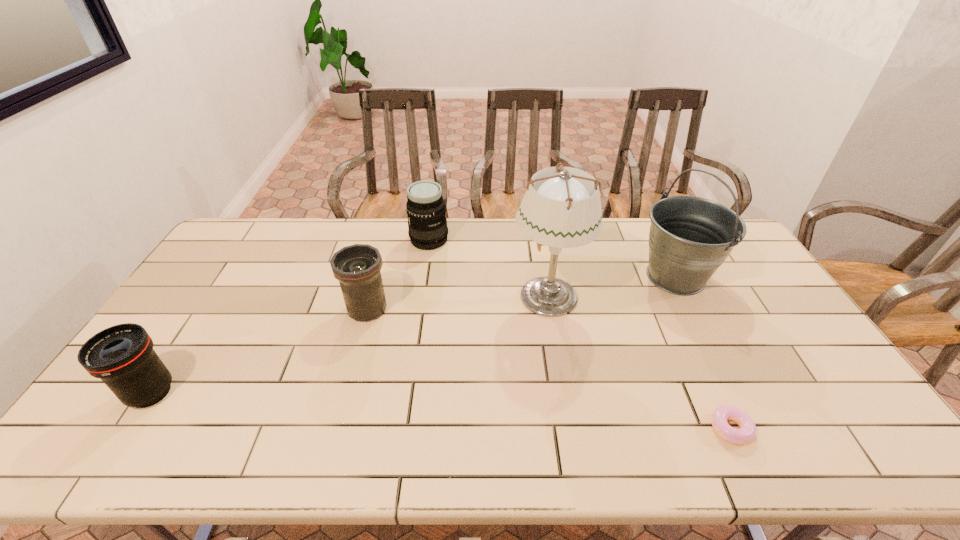
Identify the location of object positioned at the left edge. (122, 356).

Where is `object that is at the right edge`? object that is at the right edge is located at coordinates (690, 237).

I want to click on object that is at the far right corner, so click(x=690, y=237).

This screenshot has height=540, width=960. In the image, there is a desktop. What are the coordinates of `blank space at the far edge` in the screenshot? It's located at (274, 246).

At what (x,y) coordinates should I click in order to perform the action: click on free region at the near edge of the desktop. Please return your answer as a coordinate pair (x, y). The image size is (960, 540). Looking at the image, I should click on (585, 427).

At what (x,y) coordinates should I click in order to perform the action: click on free space at the left edge of the desktop. Please return your answer as a coordinate pair (x, y). This screenshot has width=960, height=540. Looking at the image, I should click on (217, 303).

In the image, there is a desktop. At what (x,y) coordinates should I click in order to perform the action: click on free space at the right edge. Please return your answer as a coordinate pair (x, y). Looking at the image, I should click on (767, 346).

Locate an element on the screen. The width and height of the screenshot is (960, 540). free space between the shortest object and the second nearest telephoto lens is located at coordinates (549, 369).

Where is `vacant space that's between the shortest object and the third object from right to left`? vacant space that's between the shortest object and the third object from right to left is located at coordinates (640, 362).

Find the location of `vacant region between the lampshade and the bucket`. vacant region between the lampshade and the bucket is located at coordinates (612, 286).